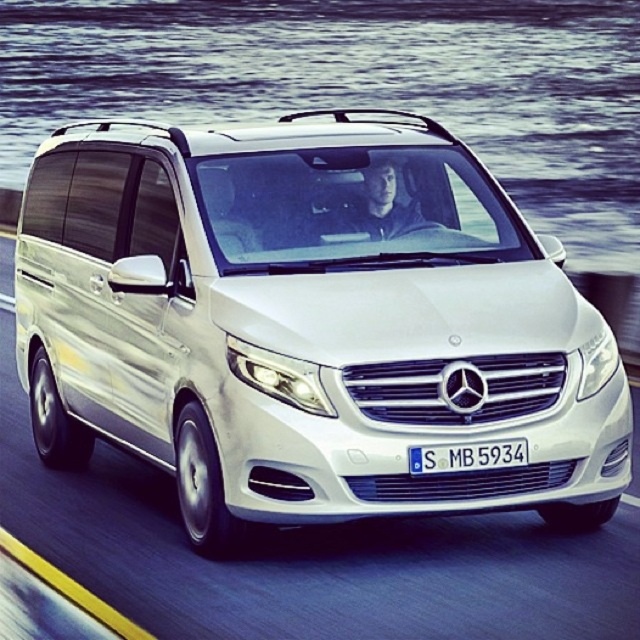
Question: Does white matte van at center appear over white plastic license plate at center?

Choices:
 (A) yes
 (B) no

Answer: (A)

Question: Which point appears farthest from the camera in this image?

Choices:
 (A) (332, 220)
 (B) (209, 44)

Answer: (B)

Question: Can you confirm if white matte van at center is positioned below white plastic license plate at center?

Choices:
 (A) yes
 (B) no

Answer: (B)

Question: Which of the following is the farthest from the observer?

Choices:
 (A) white plastic license plate at center
 (B) clear water at center
 (C) white matte van at center

Answer: (B)

Question: Does clear water at center lie in front of white plastic license plate at center?

Choices:
 (A) yes
 (B) no

Answer: (B)

Question: Which of these objects is positioned closest to the clear water at center?

Choices:
 (A) white plastic license plate at center
 (B) white matte van at center

Answer: (B)